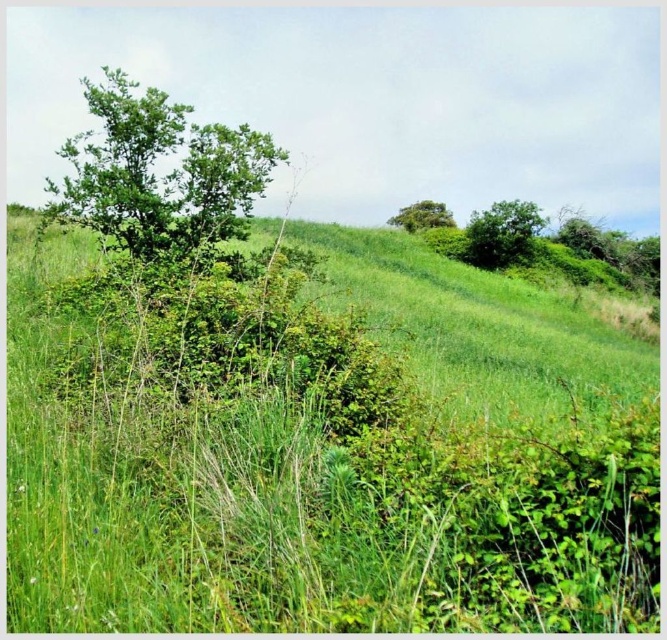
You are standing at the point marked by the coordinates point (279,474) in the image. Based on the scene description, what type of vegetation are you most likely standing on?

The point (279,474) corresponds to green grassy at center, so you are most likely standing on green grassy vegetation.

You are standing at the center of the image and want to walk towards the green grassy at center. According to the coordinates provided, in which direction should you move?

The green grassy at center is located at coordinates point [279,474]. Since you are already at the center, you are already at the green grassy at center.